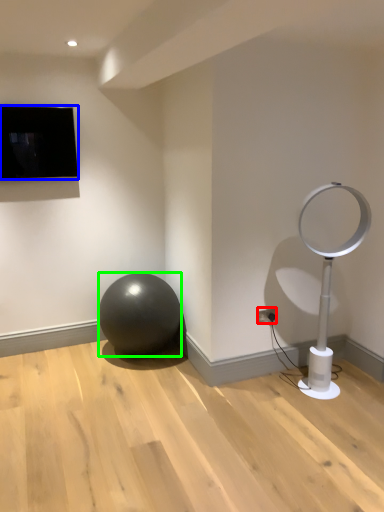
Question: Considering the real-world distances, which object is closest to electric outlet (highlighted by a red box)? television (highlighted by a blue box) or ball (highlighted by a green box).

Choices:
 (A) television
 (B) ball

Answer: (B)